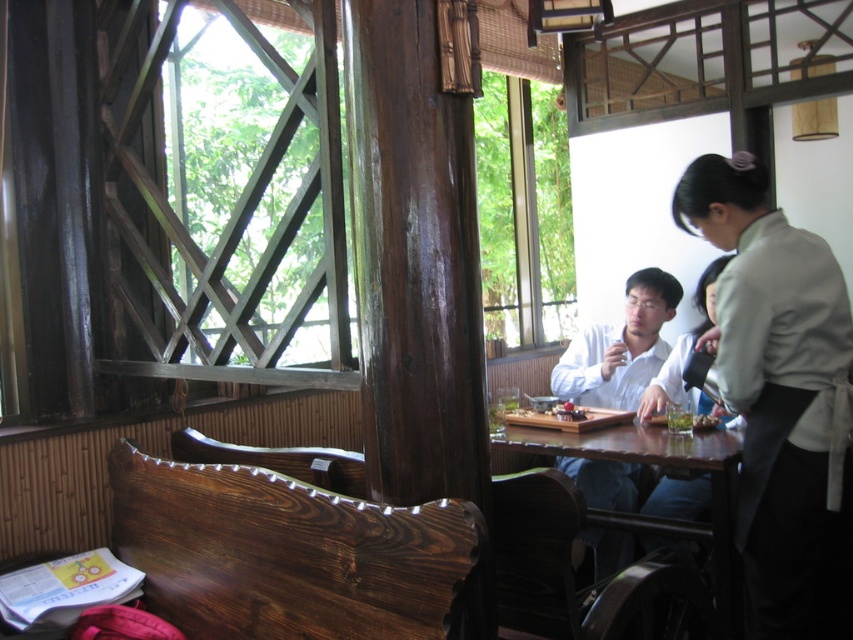
Question: Does light beige fabric apron at right appear over white glossy shirt at center?

Choices:
 (A) no
 (B) yes

Answer: (A)

Question: Which object is closer to the camera taking this photo?

Choices:
 (A) brown wooden table at center
 (B) green leafy vegetables at table
 (C) white glossy shirt at center
 (D) light beige fabric apron at right

Answer: (D)

Question: Does white glossy shirt at center appear on the right side of brown wooden table at center?

Choices:
 (A) yes
 (B) no

Answer: (A)

Question: Which of the following is the closest to the observer?

Choices:
 (A) (677, 212)
 (B) (657, 445)
 (C) (666, 419)

Answer: (A)

Question: Among these points, which one is nearest to the camera?

Choices:
 (A) pyautogui.click(x=674, y=410)
 (B) pyautogui.click(x=596, y=461)
 (C) pyautogui.click(x=531, y=442)
 (D) pyautogui.click(x=845, y=291)

Answer: (D)

Question: From the image, what is the correct spatial relationship of light beige fabric apron at right in relation to brown wooden table at center?

Choices:
 (A) left
 (B) right

Answer: (B)